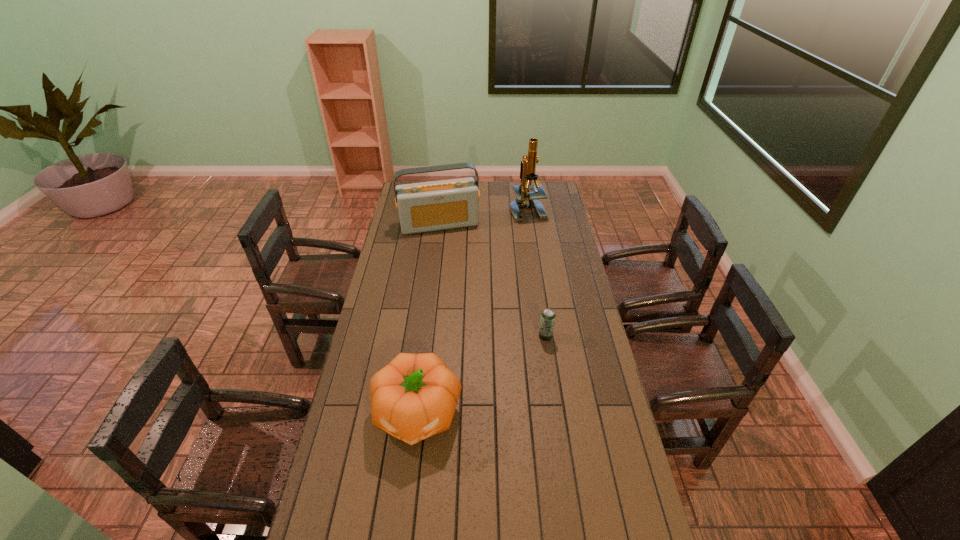
At what (x,y) coordinates should I click in order to perform the action: click on vacant region at the near edge of the desktop. Please return your answer as a coordinate pair (x, y). Looking at the image, I should click on (568, 539).

In the image, there is a desktop. Identify the location of free region at the left edge. (407, 273).

You are a GUI agent. You are given a task and a screenshot of the screen. Output one action in this format:
    pyautogui.click(x=<x>, y=<y>)
    Task: Click on the vacant space at the right edge of the desktop
    The height and width of the screenshot is (540, 960).
    Given the screenshot: What is the action you would take?
    pyautogui.click(x=618, y=460)

The height and width of the screenshot is (540, 960). I want to click on free region at the far right corner of the desktop, so click(555, 193).

The image size is (960, 540). In the image, there is a desktop. Identify the location of blank space at the near right corner. (636, 514).

Where is `free space that is in between the second nearest object and the second shortest object`? The width and height of the screenshot is (960, 540). free space that is in between the second nearest object and the second shortest object is located at coordinates (481, 375).

Locate an element on the screen. The height and width of the screenshot is (540, 960). free area in between the pumpkin and the radio receiver is located at coordinates (428, 319).

Image resolution: width=960 pixels, height=540 pixels. In order to click on free spot between the second nearest object and the second tallest object in this screenshot , I will do `click(492, 280)`.

Image resolution: width=960 pixels, height=540 pixels. I want to click on free space between the shortest object and the microscope, so click(x=537, y=273).

You are a GUI agent. You are given a task and a screenshot of the screen. Output one action in this format:
    pyautogui.click(x=<x>, y=<y>)
    Task: Click on the vacant point located between the nearest object and the microscope
    The height and width of the screenshot is (540, 960).
    Given the screenshot: What is the action you would take?
    pyautogui.click(x=472, y=312)